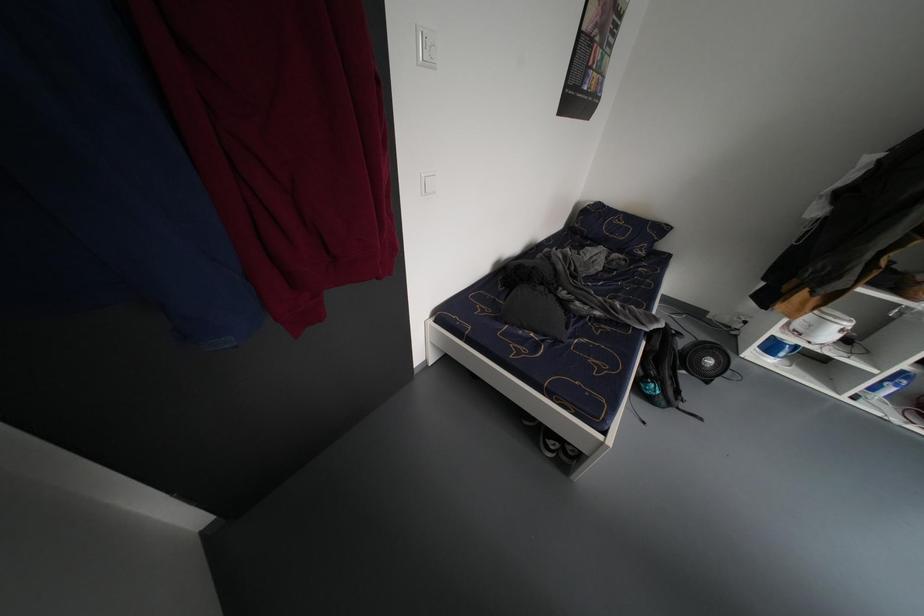
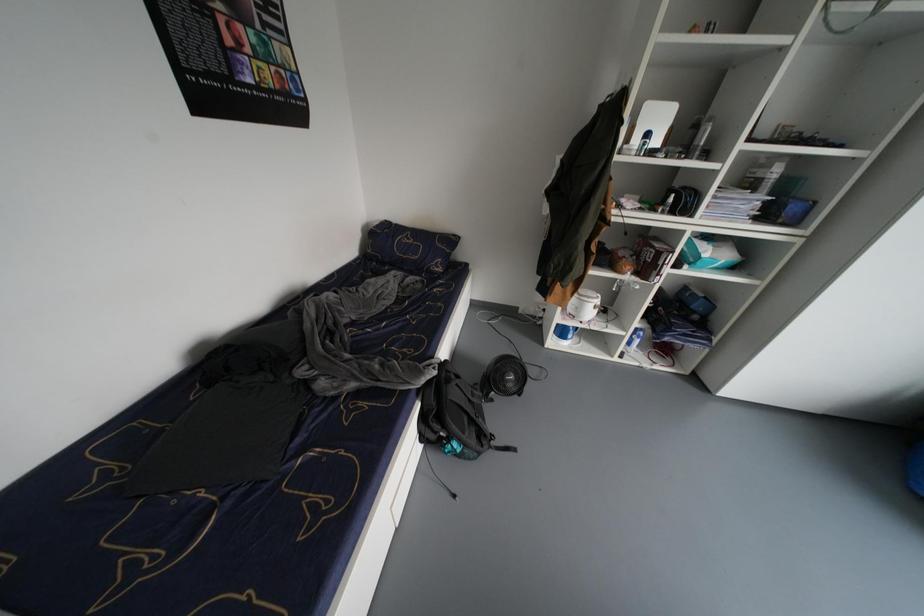
Question: In a continuous first-person perspective shot, in which direction is the camera moving?

Choices:
 (A) Left
 (B) Right
 (C) Forward
 (D) Backward

Answer: (B)